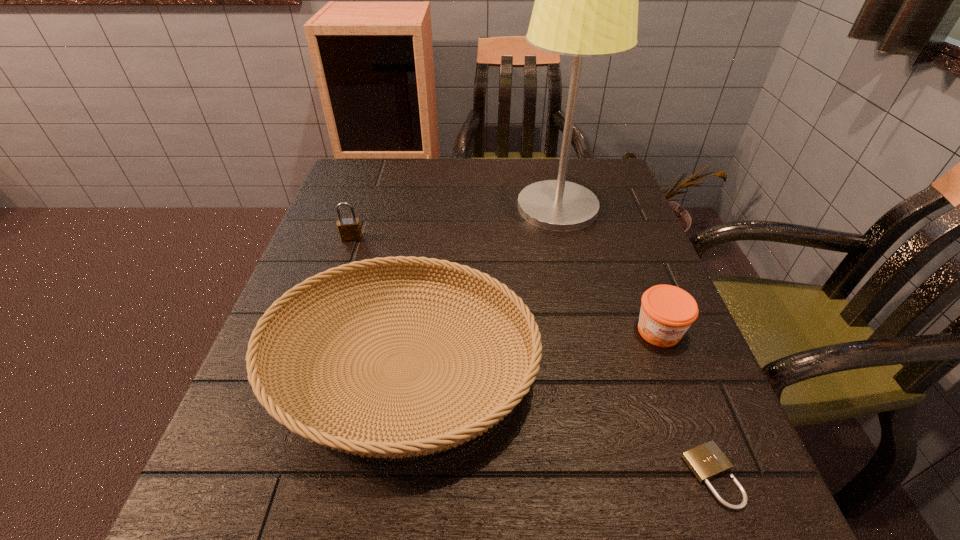
Locate an element on the screen. The image size is (960, 540). free area in between the tallest object and the nearer padlock is located at coordinates (635, 341).

The image size is (960, 540). I want to click on free space between the nearer padlock and the jam, so click(x=685, y=403).

Locate an element on the screen. The width and height of the screenshot is (960, 540). object that ranks as the fourth closest to the fourth nearest object is located at coordinates (706, 461).

Identify which object is located as the fourth nearest to the basket. Please provide its 2D coordinates. Your answer should be formatted as a tuple, i.e. [(x, y)], where the tuple contains the x and y coordinates of a point satisfying the conditions above.

[(706, 461)]

I want to click on vacant area that satisfies the following two spatial constraints: 1. on the back side of the taller padlock; 2. on the left side of the farthest object, so click(362, 207).

This screenshot has width=960, height=540. I want to click on vacant point that satisfies the following two spatial constraints: 1. on the back side of the farthest object; 2. on the right side of the second farthest object, so click(x=362, y=207).

This screenshot has height=540, width=960. In order to click on vacant space that satisfies the following two spatial constraints: 1. on the back side of the table lamp; 2. on the left side of the taller padlock in this screenshot , I will do `click(362, 207)`.